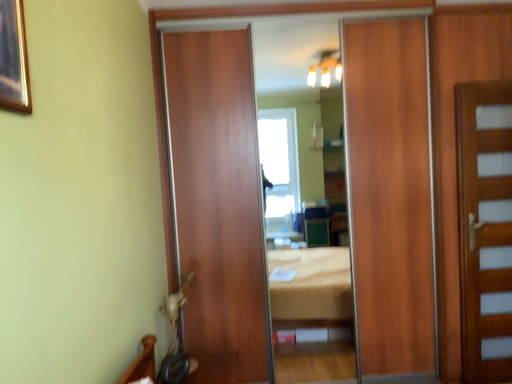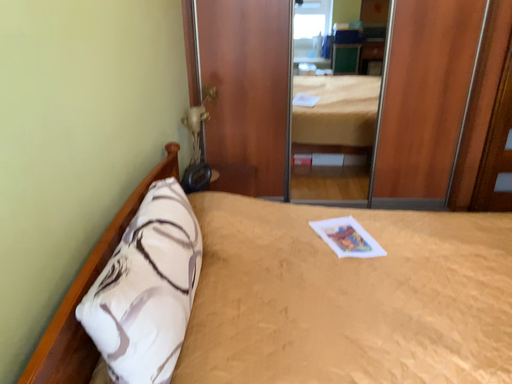
Question: Which way did the camera rotate in the video?

Choices:
 (A) rotated downward
 (B) rotated upward

Answer: (A)